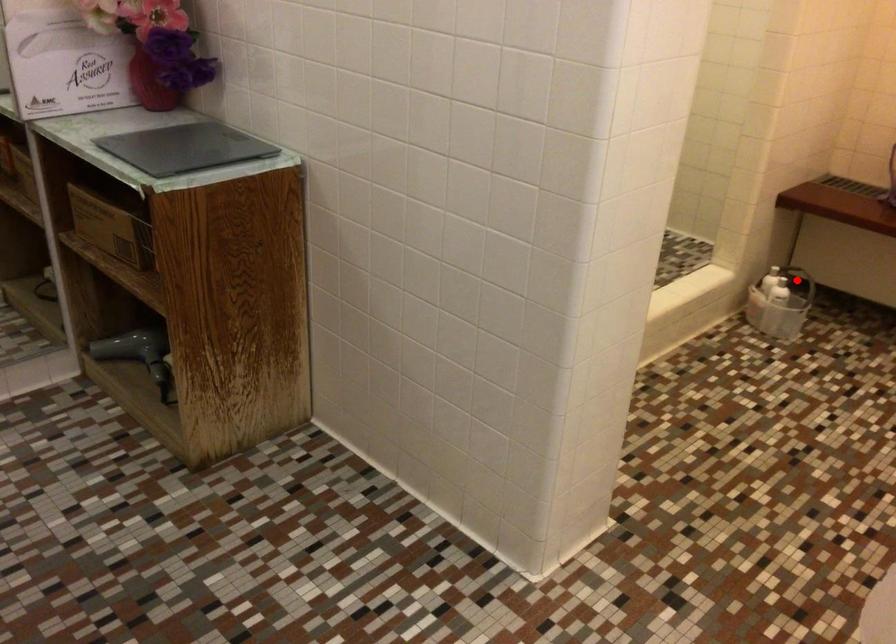
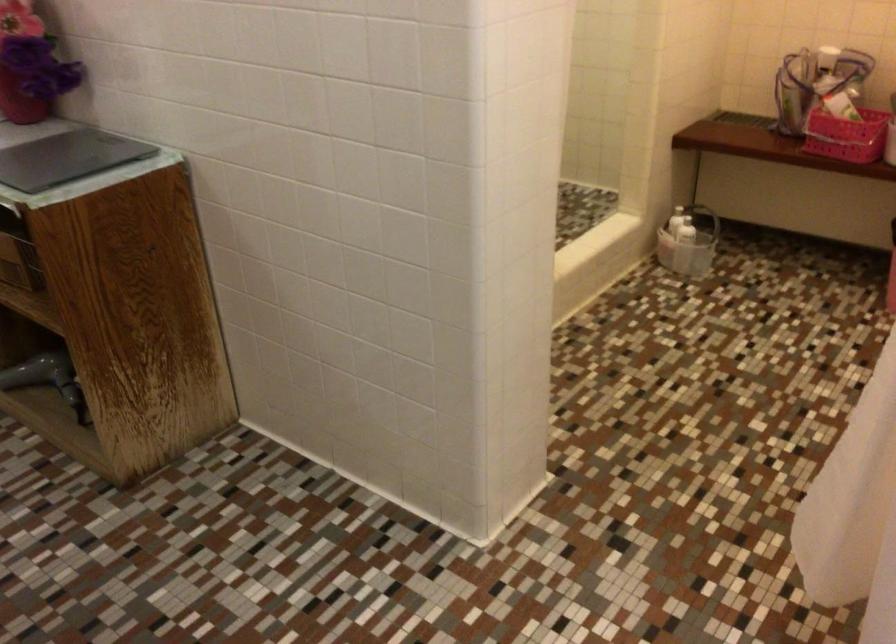
In the second image, find the point that corresponds to the highlighted location in the first image.

(703, 216)